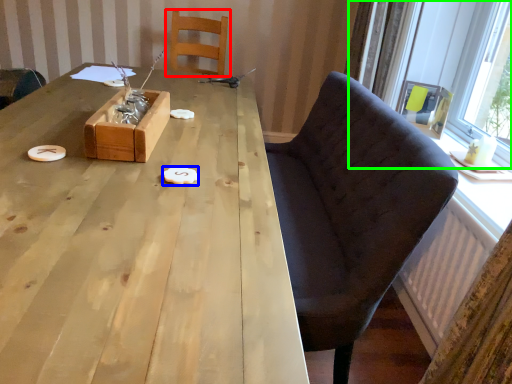
Question: Which object is the farthest from chair (highlighted by a red box)? Choose among these: food (highlighted by a blue box) or window (highlighted by a green box).

Choices:
 (A) food
 (B) window

Answer: (A)